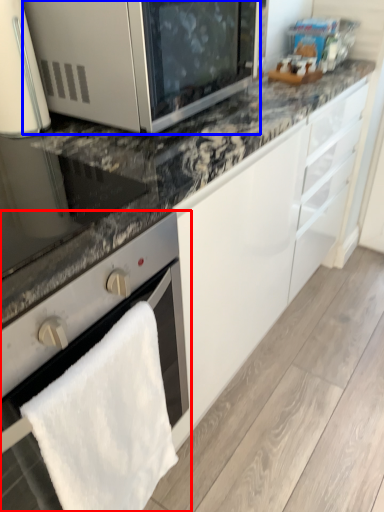
Question: Which point is further to the camera, oven (highlighted by a red box) or microwave oven (highlighted by a blue box)?

Choices:
 (A) oven
 (B) microwave oven

Answer: (B)